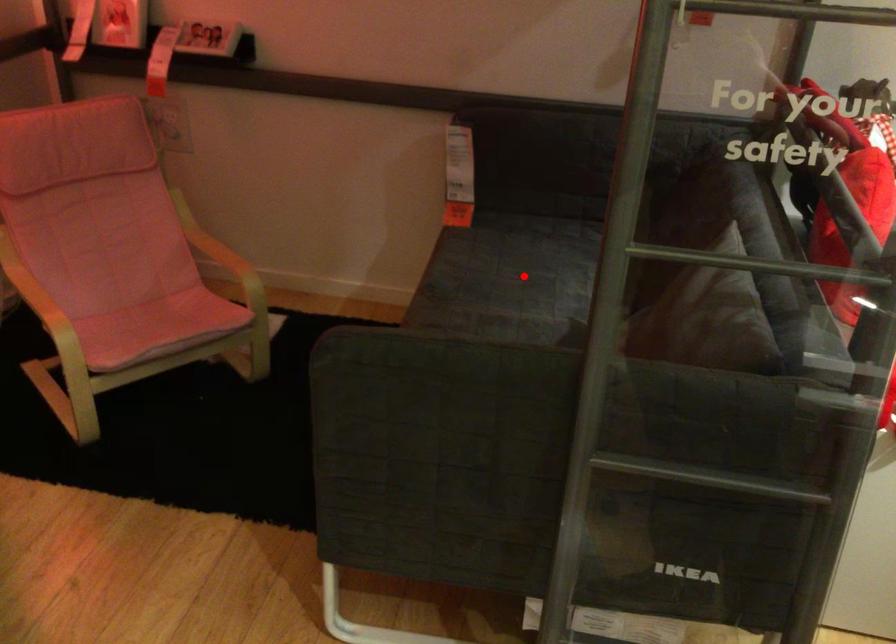
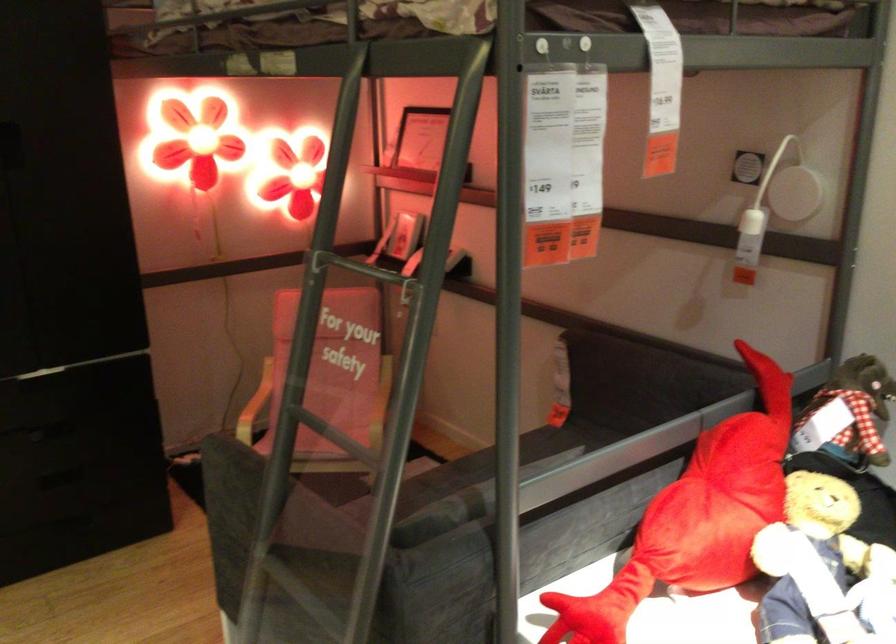
Question: I am providing you with two images of the same scene from different viewpoints. A red point is marked on the first image. Is the red point's position out of view in image 2?

Choices:
 (A) Yes
 (B) No

Answer: (A)